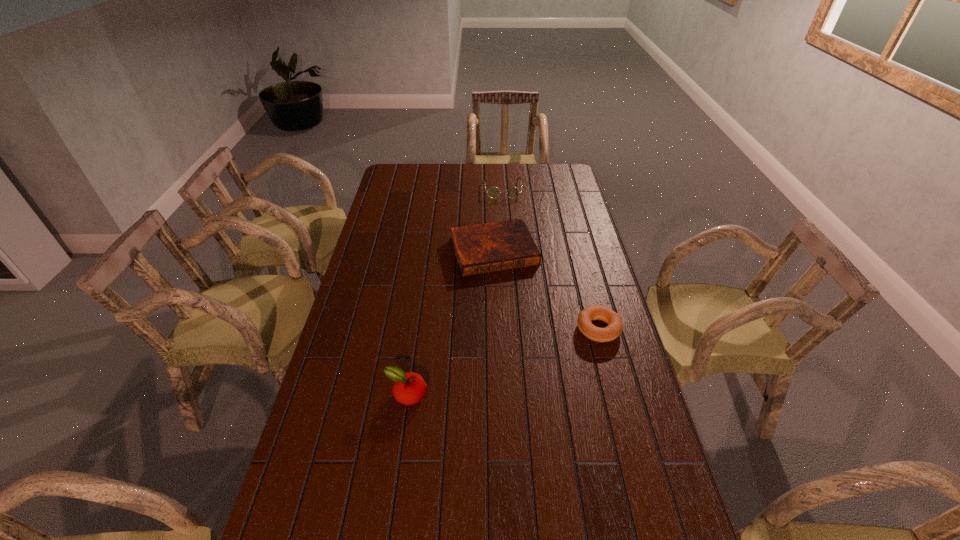
Where is `the tallest object`? the tallest object is located at coordinates (409, 388).

In order to click on the leftmost object in this screenshot , I will do `click(409, 388)`.

Identify the location of bagel. This screenshot has height=540, width=960. (613, 330).

You are a GUI agent. You are given a task and a screenshot of the screen. Output one action in this format:
    pyautogui.click(x=<x>, y=<y>)
    Task: Click on the second nearest object
    
    Given the screenshot: What is the action you would take?
    pyautogui.click(x=613, y=330)

This screenshot has height=540, width=960. Find the location of `spectacles`. spectacles is located at coordinates (513, 192).

Where is `the third nearest object`? The width and height of the screenshot is (960, 540). the third nearest object is located at coordinates (490, 247).

At what (x,y) coordinates should I click in order to perform the action: click on vacant space located 0.060m on the back of the leftmost object. Please return your answer as a coordinate pair (x, y). Looking at the image, I should click on (411, 364).

The width and height of the screenshot is (960, 540). I want to click on vacant space situated 0.070m on the left of the rightmost object, so click(x=555, y=328).

In order to click on blank space located 0.390m on the lenses of the spectacles in this screenshot , I will do `click(507, 252)`.

I want to click on vacant point located 0.280m on the lenses of the spectacles, so click(x=506, y=235).